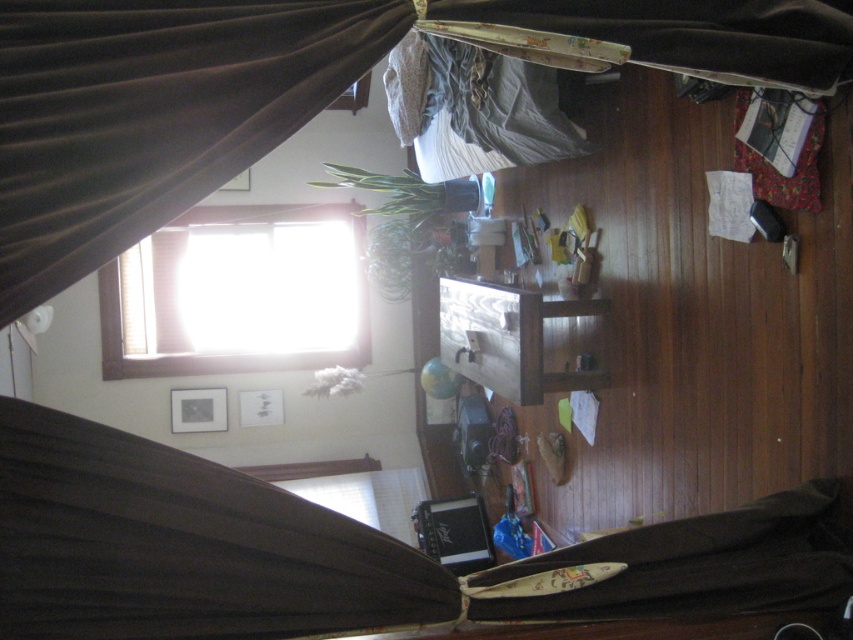
You are standing in the room and want to let more natural light into the room. Which object should you move to achieve this? The velvet brown curtain at upper left or the transparent glass window at upper center?

The velvet brown curtain at upper left is positioned over the transparent glass window at upper center. To let more natural light in, you should move the velvet brown curtain at upper left away from the window.

You are standing in the room and want to open the velvet brown curtain at upper left located at point (152, 113). Which direction should you move to reach it?

The velvet brown curtain at upper left is located at point (152, 113), so you should move towards the upper left direction to reach it.

You are arranging a photo shoot in this room and need to decide where to place the backdrop. The backdrop requires a large, unobstructed space. Based on the scene, which object between the velvet brown curtain at upper left and the transparent glass window at upper center would you choose to place the backdrop behind?

You should choose the transparent glass window at upper center because it occupies more space than the velvet brown curtain at upper left, providing a larger area for the backdrop.